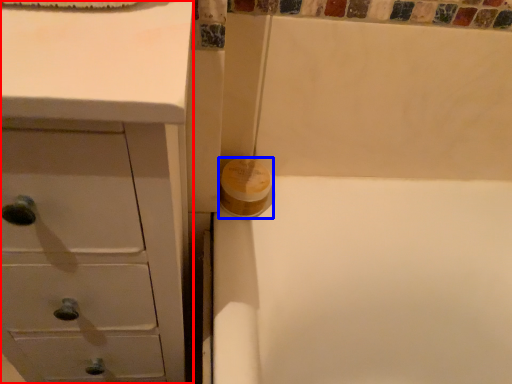
Question: Which object is closer to the camera taking this photo, chest of drawers (highlighted by a red box) or toilet paper (highlighted by a blue box)?

Choices:
 (A) chest of drawers
 (B) toilet paper

Answer: (A)